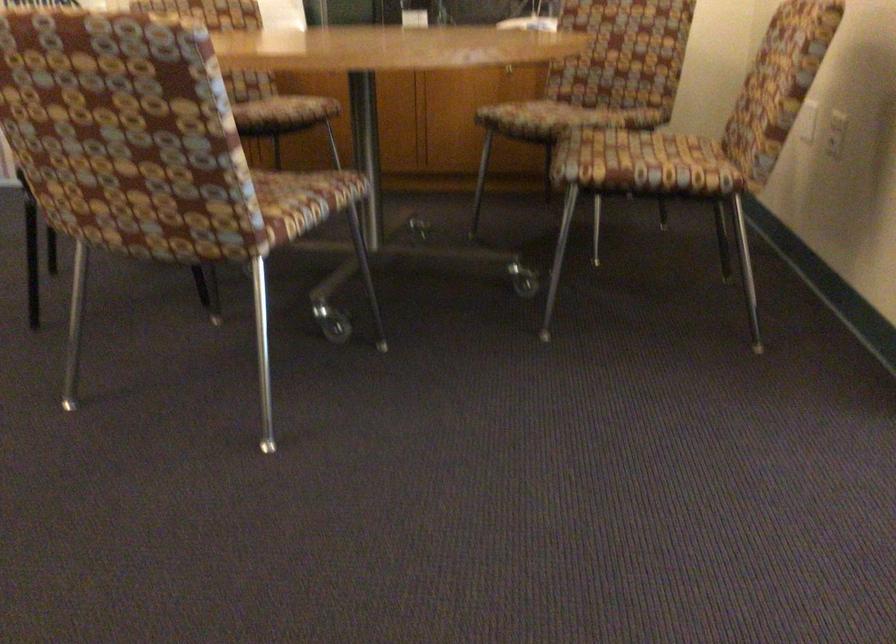
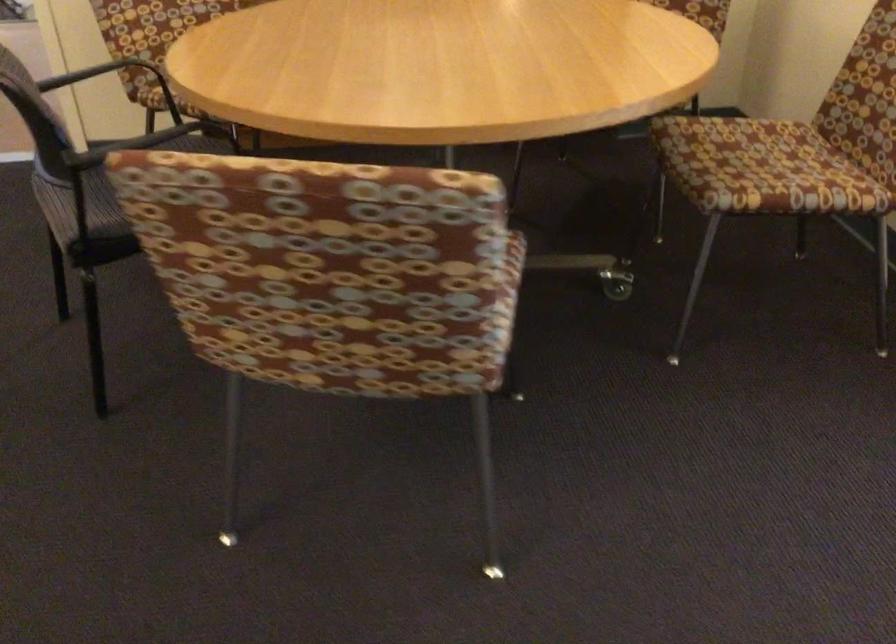
The images are taken continuously from a first-person perspective. In which direction are you moving?

The cameraman walked toward left, forward.